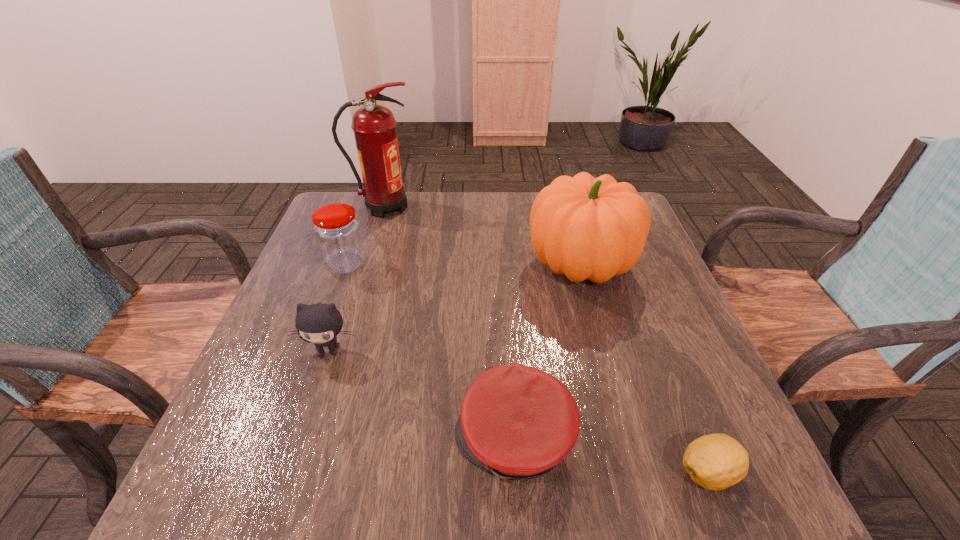
At what (x,y) coordinates should I click in order to perform the action: click on vacant space at the far edge of the desktop. Please return your answer as a coordinate pair (x, y). Image resolution: width=960 pixels, height=540 pixels. Looking at the image, I should click on (475, 193).

This screenshot has height=540, width=960. Identify the location of vacant region at the near edge of the desktop. (489, 479).

At what (x,y) coordinates should I click in order to perform the action: click on vacant area at the right edge. Please return your answer as a coordinate pair (x, y). The width and height of the screenshot is (960, 540). Looking at the image, I should click on point(667,381).

I want to click on free space that is in between the shortest object and the farthest object, so click(546, 340).

The height and width of the screenshot is (540, 960). I want to click on vacant region between the second shortest object and the shortest object, so click(612, 456).

Image resolution: width=960 pixels, height=540 pixels. I want to click on free area in between the cap and the pumpkin, so click(547, 352).

The image size is (960, 540). I want to click on free space between the cap and the lemon, so [612, 456].

This screenshot has height=540, width=960. Find the location of `vacant area that lies between the pumpkin and the shortest object`. vacant area that lies between the pumpkin and the shortest object is located at coordinates (645, 368).

The width and height of the screenshot is (960, 540). I want to click on vacant space that's between the fourth shortest object and the second shortest object, so click(430, 353).

Where is `free spot between the lemon and the fire extinguisher`? free spot between the lemon and the fire extinguisher is located at coordinates (546, 340).